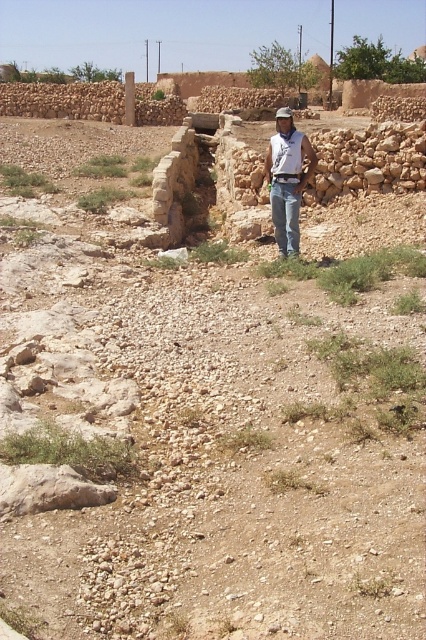
You are a photographer trying to capture the man in the scene. You notice the white denim jeans at center and the brown fabric baseball hat at center. Which object should you focus on if you want to include both but prioritize the one that takes up more space in the frame?

The brown fabric baseball hat at center takes up more space in the frame since it has a greater width than the white denim jeans at center.